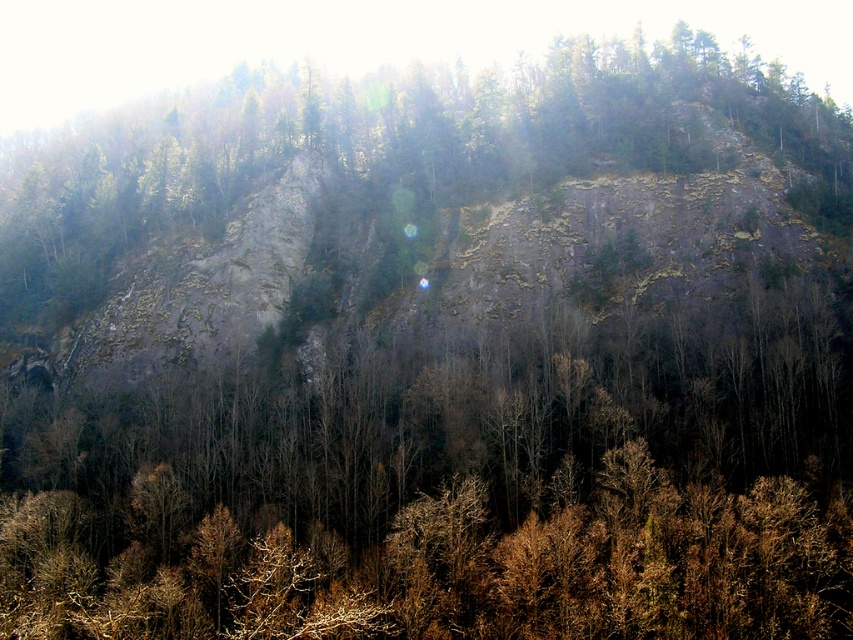
Question: Observing the image, what is the correct spatial positioning of dark brown bark tree at center in reference to green rough rock at upper center?

Choices:
 (A) below
 (B) above

Answer: (A)

Question: Does dark brown bark tree at center appear over green rough rock at upper center?

Choices:
 (A) no
 (B) yes

Answer: (A)

Question: Which of the following is the closest to the observer?

Choices:
 (A) green rough rock at upper center
 (B) dark brown bark tree at center

Answer: (B)

Question: Is dark brown bark tree at center above green rough rock at upper center?

Choices:
 (A) no
 (B) yes

Answer: (A)

Question: Which object is farther from the camera taking this photo?

Choices:
 (A) green rough rock at upper center
 (B) dark brown bark tree at center

Answer: (A)